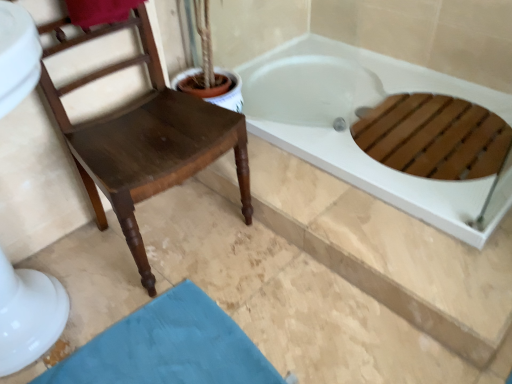
Question: Is point click(306, 114) closer or farther from the camera than point click(190, 286)?

Choices:
 (A) farther
 (B) closer

Answer: (A)

Question: From the image's perspective, is white glossy bathtub at upper right located above or below teal fabric bath mat at lower left?

Choices:
 (A) above
 (B) below

Answer: (A)

Question: Estimate the real-world distances between objects in this image. Which object is closer to the teal fabric bath mat at lower left?

Choices:
 (A) white glossy bathtub at upper right
 (B) dark brown wood chair at left

Answer: (B)

Question: Estimate the real-world distances between objects in this image. Which object is farther from the dark brown wood chair at left?

Choices:
 (A) teal fabric bath mat at lower left
 (B) white glossy bathtub at upper right

Answer: (B)